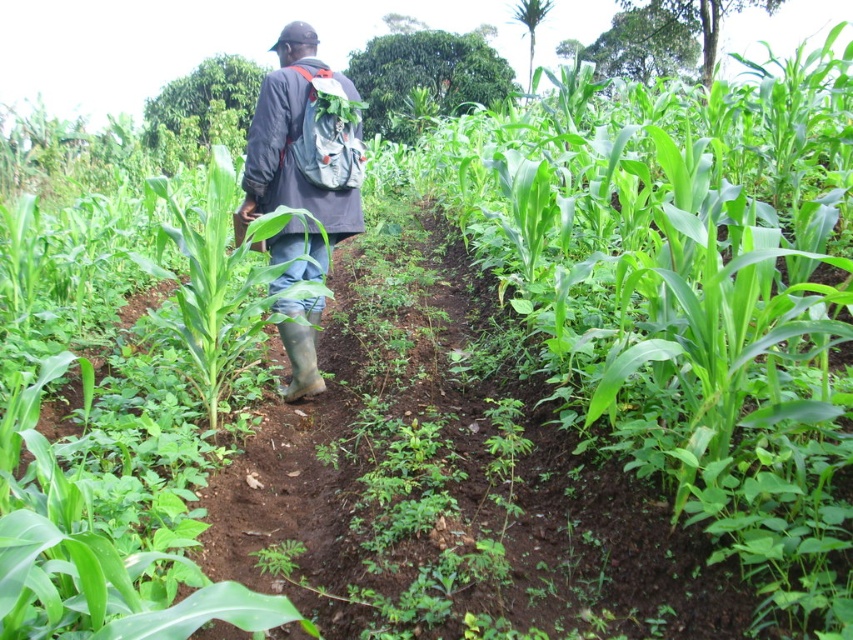
You are a farmer checking the growth of your crops. You notice the green leafy corn at center and the gray fabric backpack at center. Which object is bigger in size?

The green leafy corn at center is larger in size than the gray fabric backpack at center.

The farmer is standing at the point with coordinates (683, 292). Which object is located at that point?

The green leafy corn at center is located at the point with coordinates (683, 292).

You are a farmer standing in the field and want to check the height of the plants compared to your backpack. Which object is taller between the green leafy corn at center and the gray fabric backpack at center?

The green leafy corn at center is taller than the gray fabric backpack at center according to the description.